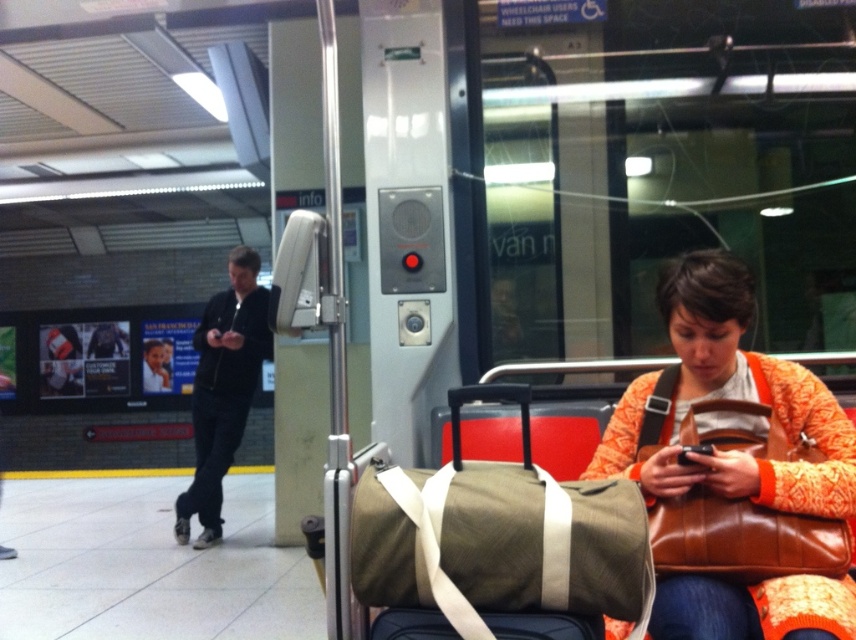
You are a traveler trying to pack your belongings into a small overhead compartment on a train. You have a brown leather bag at lower right and a green canvas duffel bag at center. Which bag should you choose to ensure it fits in the compartment?

The brown leather bag at lower right has a smaller width than the green canvas duffel bag at center, so you should choose the brown leather bag at lower right to ensure it fits in the overhead compartment.

You are standing on the subway platform and want to walk from point A to point B. Point A is at coordinate point (740, 577) and point B is at coordinate point (432, 616). Which point is closer to you when you start at point A?

Point A is closer to you since you are starting at point A. However, if you are moving from point A to point B, point B will be your destination. The question might be about which point is closer in terms of distance from the viewer. According to the description, point (740, 577) is further to the viewer than point (432, 616). Wait, the description says the opposite. Let me check again. The Objects Description states that point (740, 577) is further to the viewer than point (432, 616). So when you,